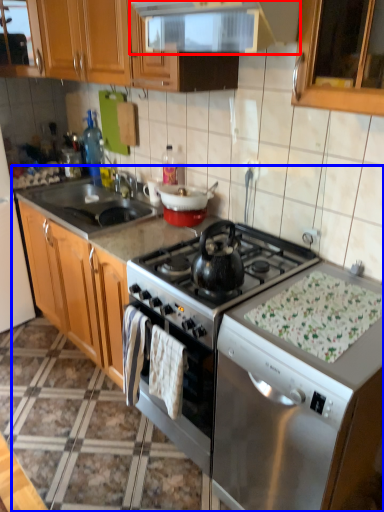
Question: Which object is closer to the camera taking this photo, kitchen appliance (highlighted by a red box) or countertop (highlighted by a blue box)?

Choices:
 (A) kitchen appliance
 (B) countertop

Answer: (A)